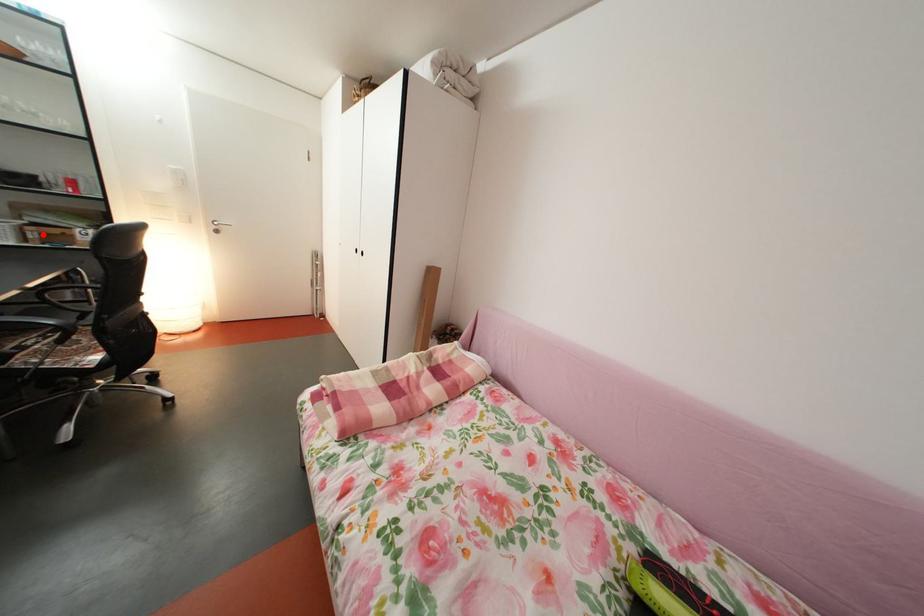
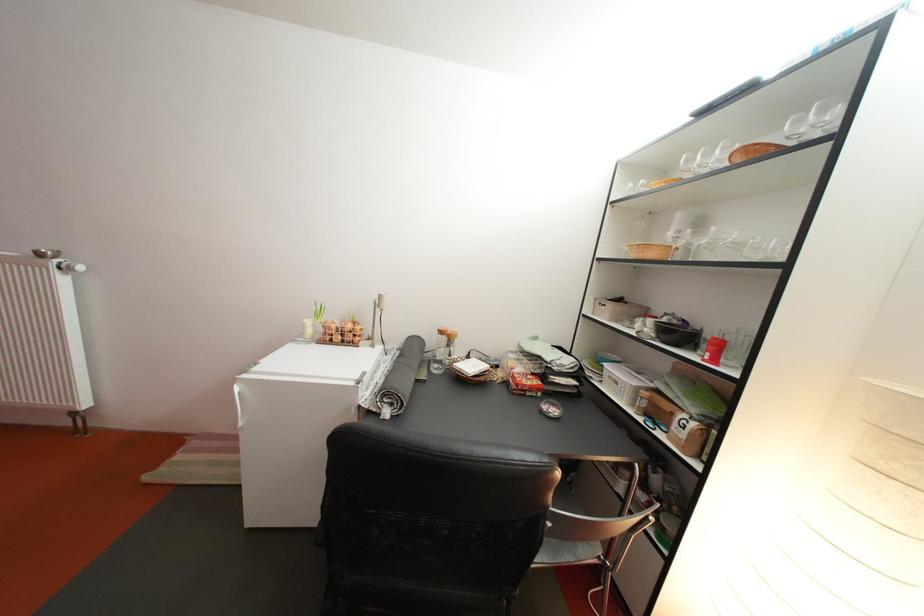
Question: I am providing you with two images of the same scene from different viewpoints. Image1 has a red point marked. In image2, the corresponding 3D location appears at what relative position? Reply with the corresponding letter.

Choices:
 (A) Closer
 (B) Farther

Answer: (A)